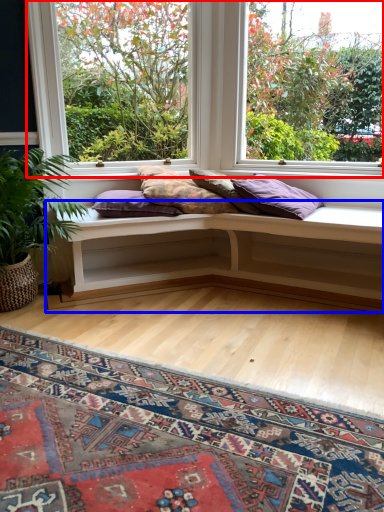
Question: Which object is further to the camera taking this photo, window (highlighted by a red box) or table (highlighted by a blue box)?

Choices:
 (A) window
 (B) table

Answer: (A)